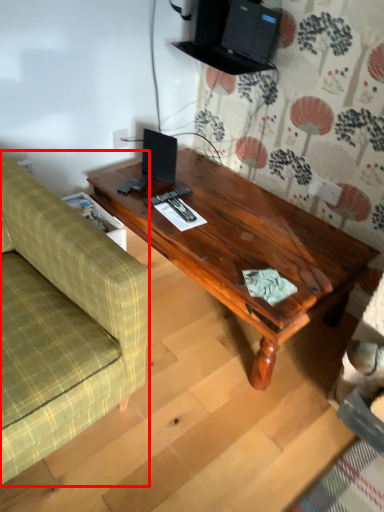
Question: From the image's perspective, where is studio couch (annotated by the red box) located in relation to coffee table in the image?

Choices:
 (A) above
 (B) below

Answer: (B)